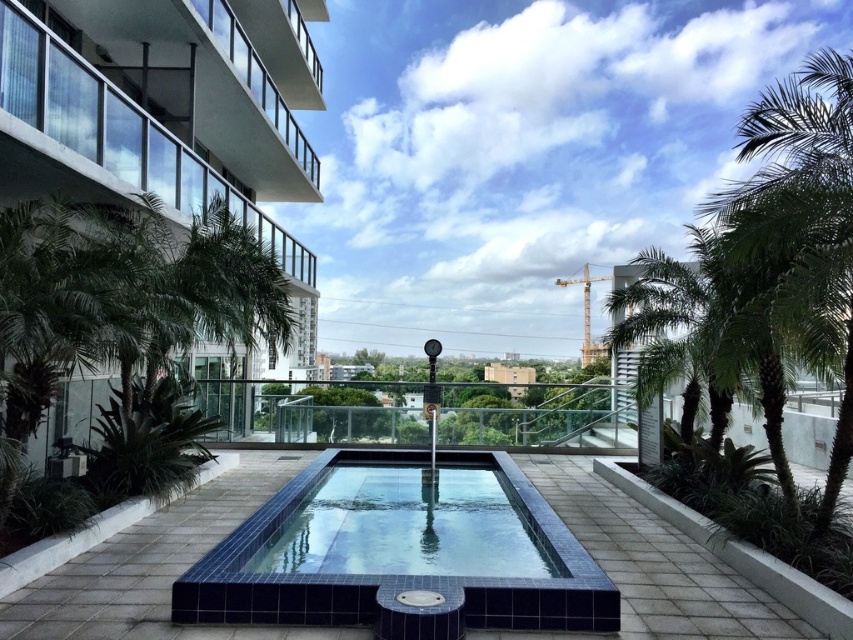
Is point (190, 42) positioned behind point (563, 538)?

Yes, point (190, 42) is behind point (563, 538).

Is glassy concrete balcony at upper left above blue tile swimming pool at center?

Indeed, glassy concrete balcony at upper left is positioned over blue tile swimming pool at center.

Does point (181, 150) come behind point (283, 490)?

Yes, it is.

At what (x,y) coordinates should I click in order to perform the action: click on glassy concrete balcony at upper left. Please return your answer as a coordinate pair (x, y). The height and width of the screenshot is (640, 853). Looking at the image, I should click on (151, 129).

Can you confirm if blue tile swimming pool at center is bigger than blue glossy pool at center?

Incorrect, blue tile swimming pool at center is not larger than blue glossy pool at center.

Which is behind, point (402, 621) or point (444, 493)?

Point (444, 493)

What do you see at coordinates (398, 573) in the screenshot? This screenshot has width=853, height=640. I see `blue tile swimming pool at center` at bounding box center [398, 573].

The image size is (853, 640). What are the coordinates of `blue tile swimming pool at center` in the screenshot? It's located at (398, 573).

Does glassy concrete balcony at upper left come behind blue glossy pool at center?

That is True.

Is point (248, 122) farther from viewer compared to point (357, 518)?

That is True.

At what (x,y) coordinates should I click in order to perform the action: click on glassy concrete balcony at upper left. Please return your answer as a coordinate pair (x, y). Looking at the image, I should click on (151, 129).